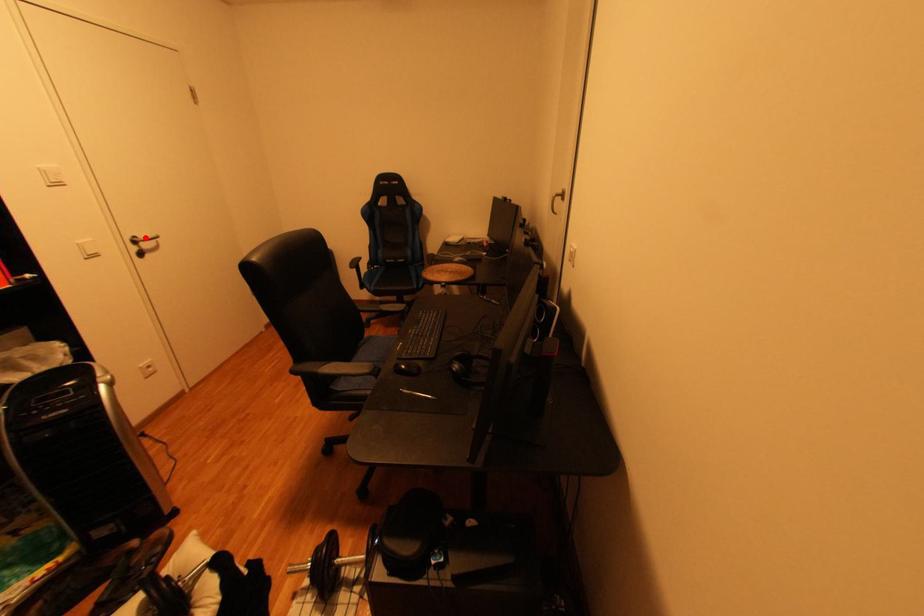
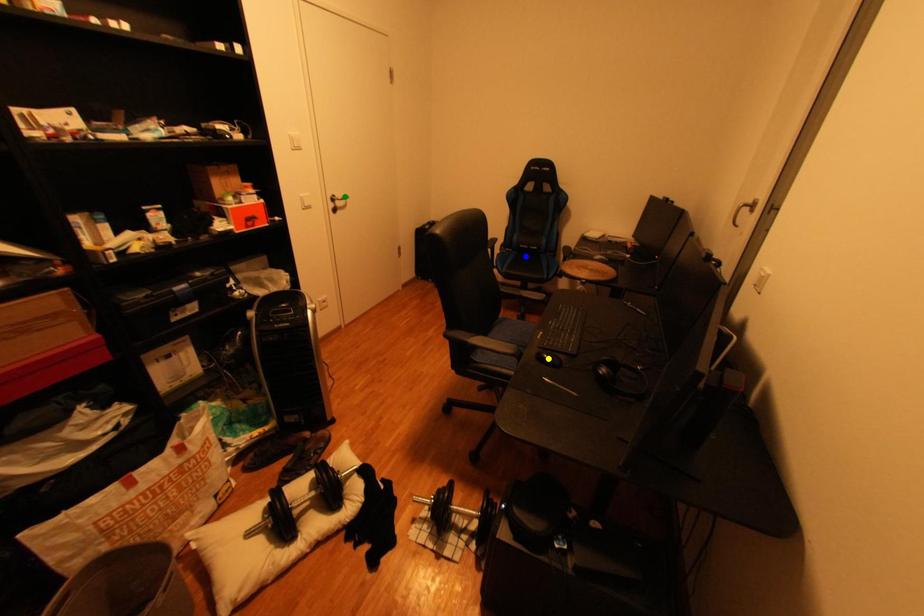
Question: I am providing you with two images of the same scene from different viewpoints. A red point is marked on the first image. You are given multiple points on the second image. Which point in image 2 represents the same 3d spot as the red point in image 1?

Choices:
 (A) blue point
 (B) yellow point
 (C) green point

Answer: (C)